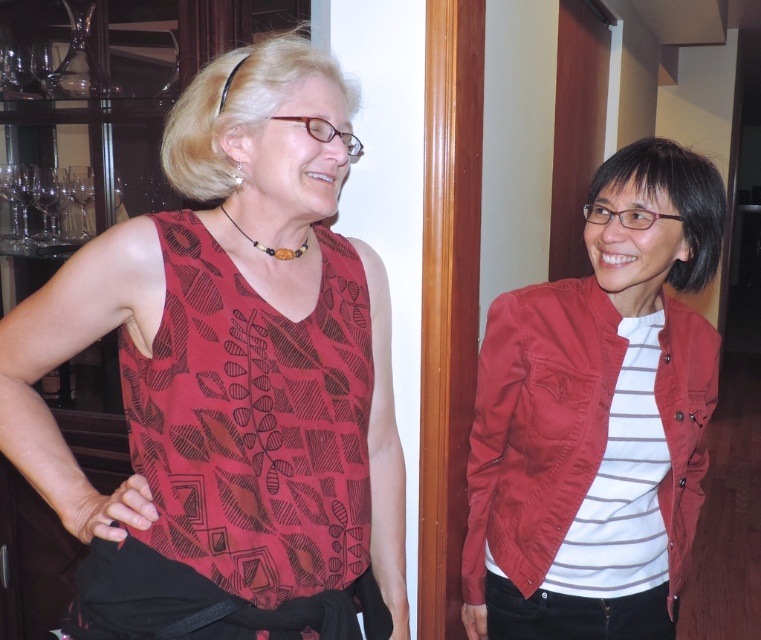
Based on the photo, you are organizing a clothing donation drive and need to categorize items by size. You have two red garments in front of you, the matte red tank top at left and the matte red jacket at right. Which one should you place in the large size bin?

The matte red tank top at left has a larger size compared to the matte red jacket at right, so you should place the matte red tank top at left in the large size bin.

You are a photographer who needs to adjust the focus on your camera. The camera is positioned between the matte red tank top at left and a black bag. Which object is closer to the camera?

The matte red tank top at left is closer to the camera since it is only 37.64 inches away from the camera, while the black bag is further away.

You are trying to decide which person is closer to you based on their clothing. The matte red tank top at left and the white striped fabric shirt at right are visible. According to the scene, which clothing item is covering part of the other?

The matte red tank top at left is positioned over the white striped fabric shirt at right, meaning the person wearing the matte red tank top at left is closer to you.